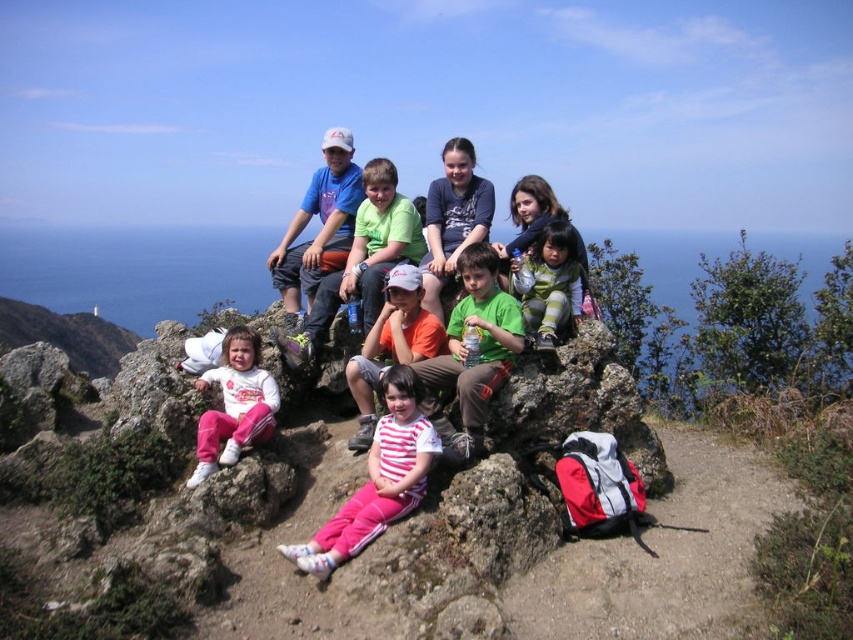
Can you confirm if striped cotton shirt at center is positioned to the left of green fabric jacket at center?

Yes, striped cotton shirt at center is to the left of green fabric jacket at center.

Which of these two, striped cotton shirt at center or green fabric jacket at center, stands taller?

With more height is striped cotton shirt at center.

Locate an element on the screen. The width and height of the screenshot is (853, 640). striped cotton shirt at center is located at coordinates (392, 344).

Where is `striped cotton shirt at center`? This screenshot has height=640, width=853. striped cotton shirt at center is located at coordinates (392, 344).

Can you confirm if matte green shirt at center is positioned to the left of striped fabric pants at center?

Yes, matte green shirt at center is to the left of striped fabric pants at center.

Between matte green shirt at center and striped fabric pants at center, which one is positioned lower?

striped fabric pants at center is lower down.

You are a GUI agent. You are given a task and a screenshot of the screen. Output one action in this format:
    pyautogui.click(x=<x>, y=<y>)
    Task: Click on the matte green shirt at center
    The image size is (853, 640).
    Given the screenshot: What is the action you would take?
    pyautogui.click(x=341, y=243)

Between matte green shirt at center and striped cotton shirt at center, which one is positioned lower?

striped cotton shirt at center is lower down.

Which of these two, matte green shirt at center or striped cotton shirt at center, stands shorter?

Standing shorter between the two is striped cotton shirt at center.

At what (x,y) coordinates should I click in order to perform the action: click on matte green shirt at center. Please return your answer as a coordinate pair (x, y). Looking at the image, I should click on (341, 243).